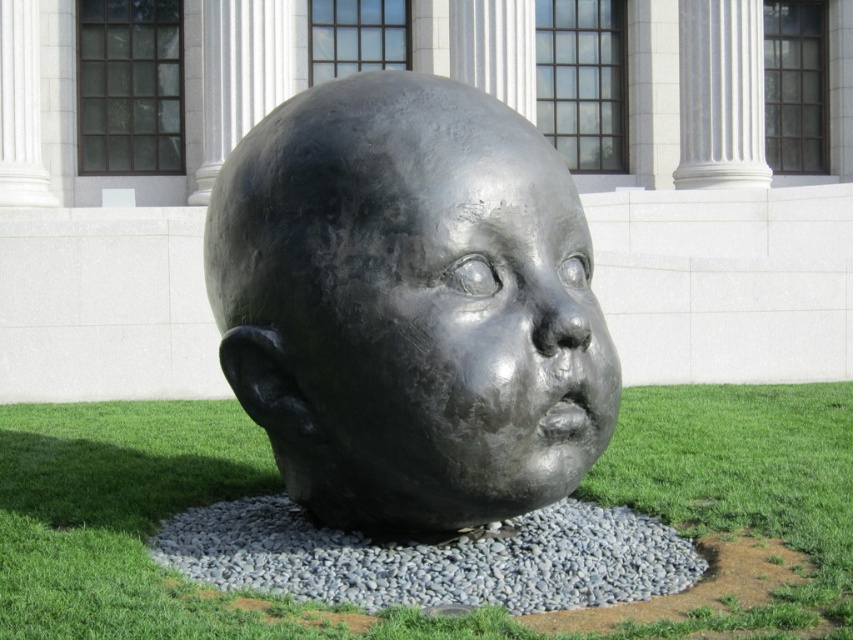
Question: Does black polished stone head at center lie in front of green grass at center?

Choices:
 (A) no
 (B) yes

Answer: (A)

Question: Does black polished stone head at center appear over shiny black face at center?

Choices:
 (A) yes
 (B) no

Answer: (A)

Question: Does black polished stone head at center appear under green grass at center?

Choices:
 (A) no
 (B) yes

Answer: (A)

Question: Which object is the farthest from the shiny black face at center?

Choices:
 (A) black polished stone head at center
 (B) gray gravel at center

Answer: (B)

Question: Among these objects, which one is nearest to the camera?

Choices:
 (A) gray gravel at center
 (B) shiny black face at center

Answer: (A)

Question: Among these objects, which one is farthest from the camera?

Choices:
 (A) shiny black face at center
 (B) white marble column at upper center

Answer: (B)